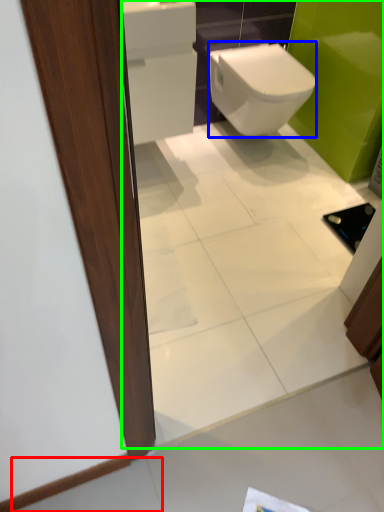
Question: Which is farther away from tile (highlighted by a red box)? bidet (highlighted by a blue box) or mirror (highlighted by a green box)?

Choices:
 (A) bidet
 (B) mirror

Answer: (A)